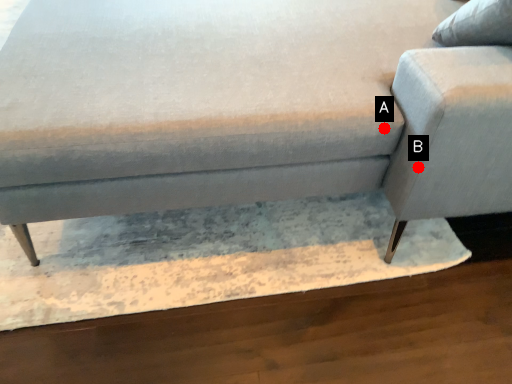
Question: Two points are circled on the image, labeled by A and B beside each circle. Which point appears closest to the camera in this image?

Choices:
 (A) A is closer
 (B) B is closer

Answer: (B)